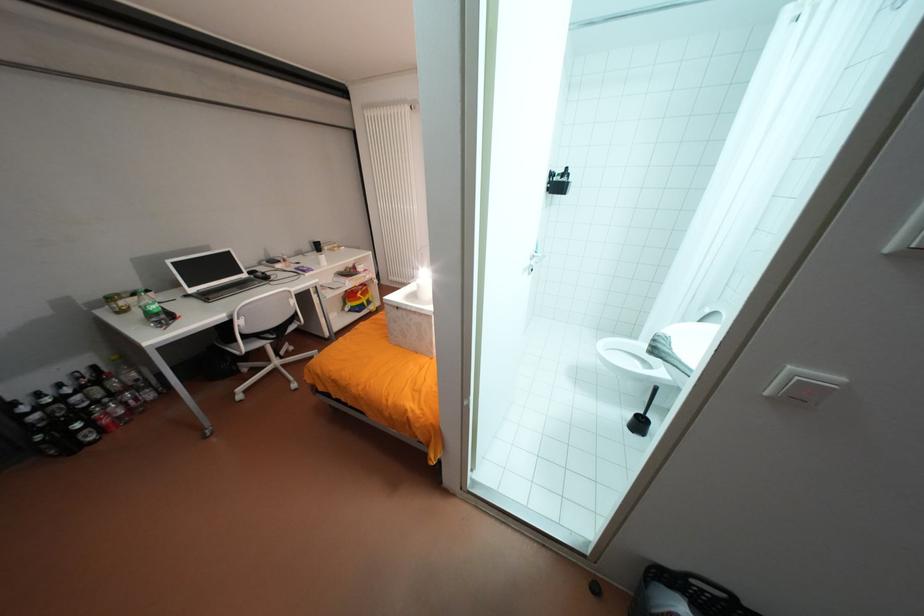
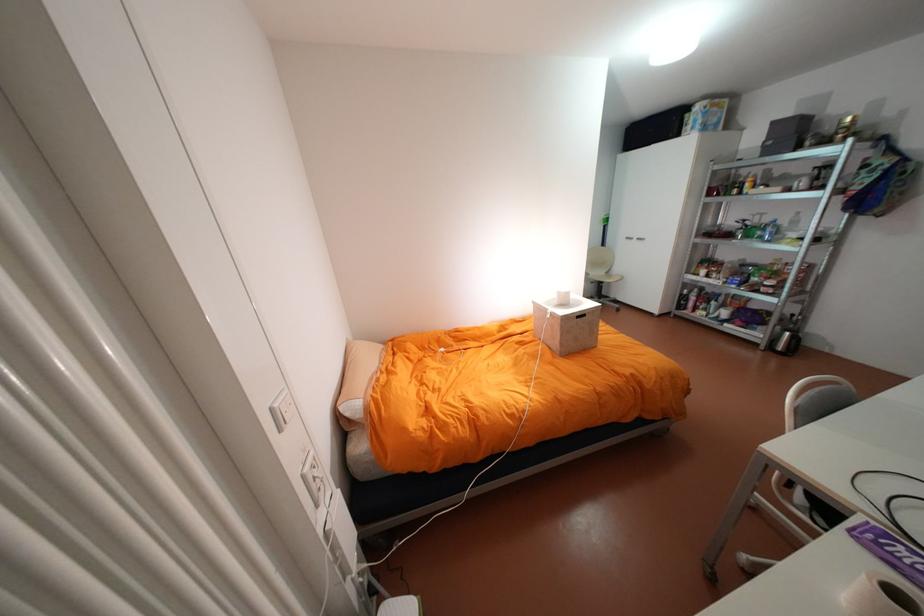
Question: I am providing you with two images of the same scene from different viewpoints. Please identify which objects are invisible in image2.

Choices:
 (A) white light switch
 (B) box handle cutout
 (C) silver cabinet handle
 (D) blue dropper bottle

Answer: (A)